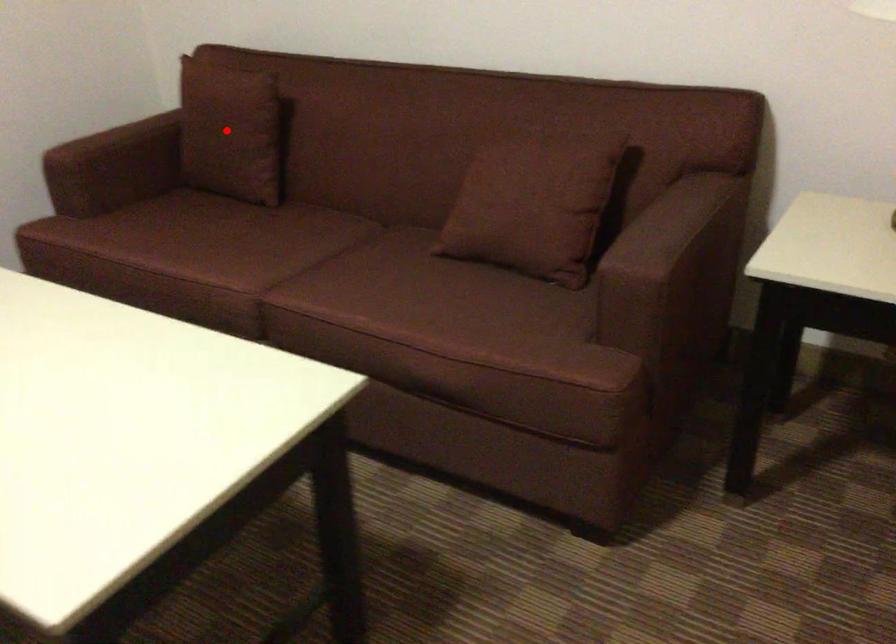
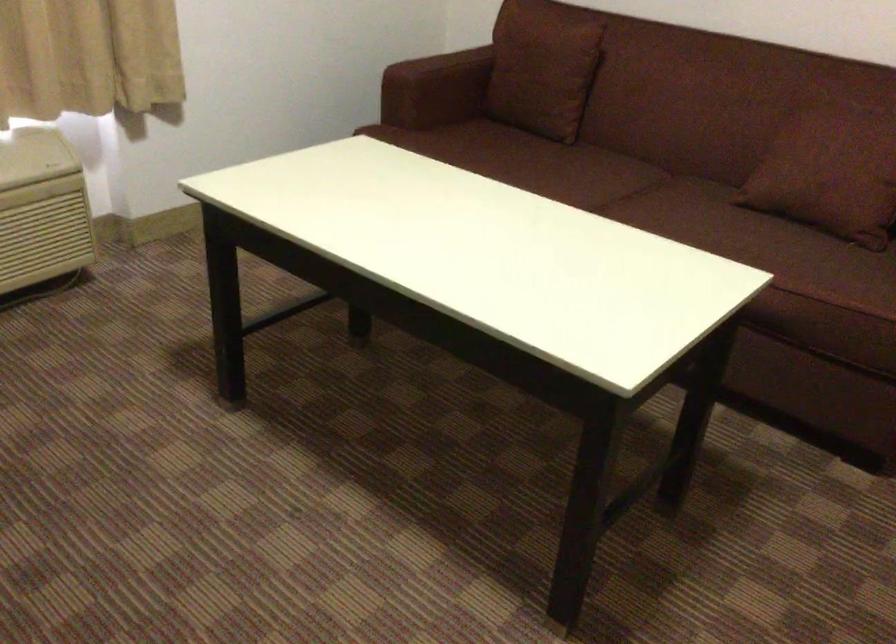
In the second image, find the point that corresponds to the highlighted location in the first image.

(543, 69)